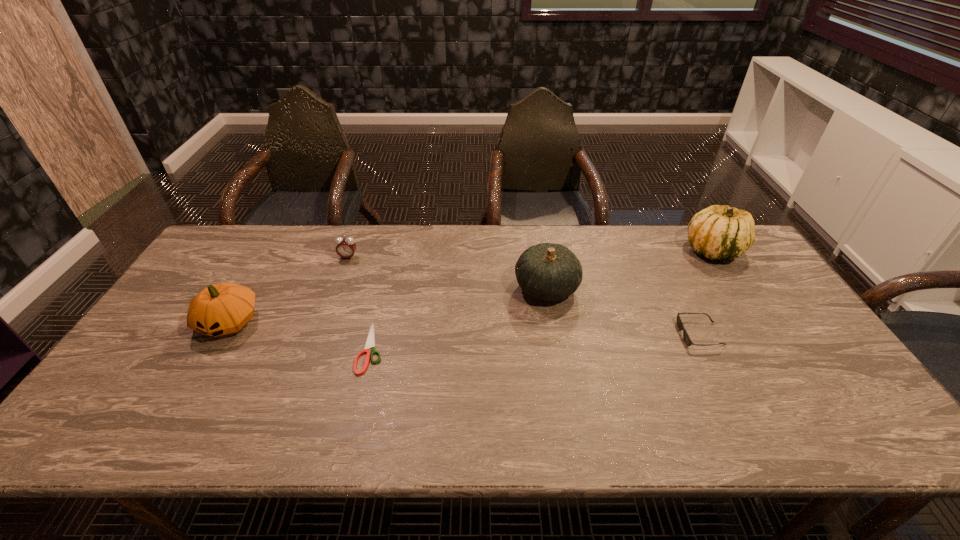
At what (x,y) coordinates should I click in order to perform the action: click on empty space between the leftmost gourd and the fourth object from left to right. Please return your answer as a coordinate pair (x, y). Looking at the image, I should click on [388, 305].

This screenshot has height=540, width=960. I want to click on vacant space that is in between the leftmost gourd and the rightmost object, so (471, 286).

At what (x,y) coordinates should I click in order to perform the action: click on vacant area between the alarm clock and the shortest object. Please return your answer as a coordinate pair (x, y). The width and height of the screenshot is (960, 540). Looking at the image, I should click on (360, 303).

Where is `vacant area between the alarm clock and the second gourd from left to right`? The image size is (960, 540). vacant area between the alarm clock and the second gourd from left to right is located at coordinates (447, 273).

Locate an element on the screen. The width and height of the screenshot is (960, 540). the fourth closest object to the sunglasses is located at coordinates (346, 247).

The width and height of the screenshot is (960, 540). What are the coordinates of `object that is the third closest to the third object from right to left` in the screenshot? It's located at (718, 232).

Locate an element on the screen. Image resolution: width=960 pixels, height=540 pixels. gourd that can be found as the second closest to the third object from left to right is located at coordinates (550, 272).

Where is `gourd that is the second closest to the second gourd from left to right`? The width and height of the screenshot is (960, 540). gourd that is the second closest to the second gourd from left to right is located at coordinates (224, 308).

Locate an element on the screen. vacant region that satisfies the following two spatial constraints: 1. on the clock face of the alarm clock; 2. on the right side of the third object from right to left is located at coordinates (337, 288).

You are a GUI agent. You are given a task and a screenshot of the screen. Output one action in this format:
    pyautogui.click(x=<x>, y=<y>)
    Task: Click on the vacant space that satisfies the following two spatial constraints: 1. on the side of the fourth object from right to left with the carved face; 2. on the right side of the leftmost gourd
    
    Given the screenshot: What is the action you would take?
    pyautogui.click(x=214, y=348)